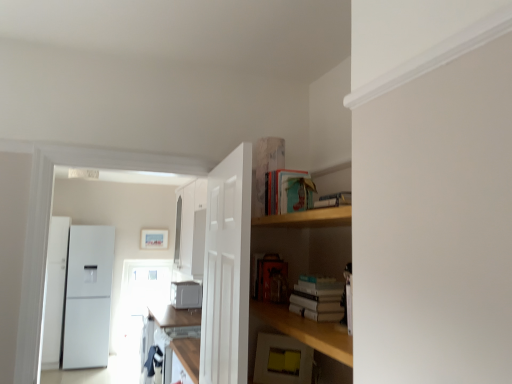
Question: From a real-world perspective, is white matte book at center, which is counted as the 2th book, starting from the top, above or below teal matte book at upper center, the 1th book viewed from the top?

Choices:
 (A) below
 (B) above

Answer: (A)

Question: Does point (297, 306) appear closer or farther from the camera than point (285, 205)?

Choices:
 (A) closer
 (B) farther

Answer: (A)

Question: Estimate the real-world distances between objects in this image. Which object is farther from the white glossy cabinet at upper left, the first cabinetry viewed from the top?

Choices:
 (A) yellow matte sticky notes at lower center, marked as the 1th appliance in a front-to-back arrangement
 (B) matte wooden picture frame at upper center
 (C) matte white cabinet at lower center, the first cabinetry when ordered from bottom to top
 (D) white matte door at center
 (E) white matte book at center, which is counted as the 2th book, starting from the top

Answer: (E)

Question: Which object is positioned farthest from the white matte microwave at center, acting as the 2th appliance starting from the top?

Choices:
 (A) matte wooden picture frame at upper center
 (B) white matte door at center
 (C) matte white cabinet at lower center, the 2th cabinetry viewed from the top
 (D) white matte book at center, which is counted as the 2th book, starting from the top
 (E) teal matte book at upper center, which ranks as the second book in bottom-to-top order

Answer: (D)